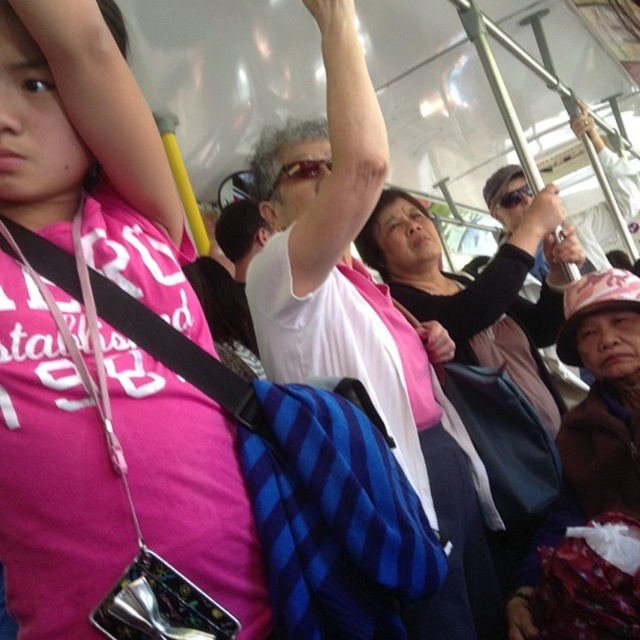
Based on the photo, is pink matte shirt at upper left bigger than brown fuzzy hat at lower right?

Incorrect, pink matte shirt at upper left is not larger than brown fuzzy hat at lower right.

Is pink matte shirt at upper left positioned at the back of brown fuzzy hat at lower right?

No, it is in front of brown fuzzy hat at lower right.

Identify the location of pink matte shirt at upper left. (90, 152).

Where is `pink matte shirt at upper left`? The image size is (640, 640). pink matte shirt at upper left is located at coordinates (90, 152).